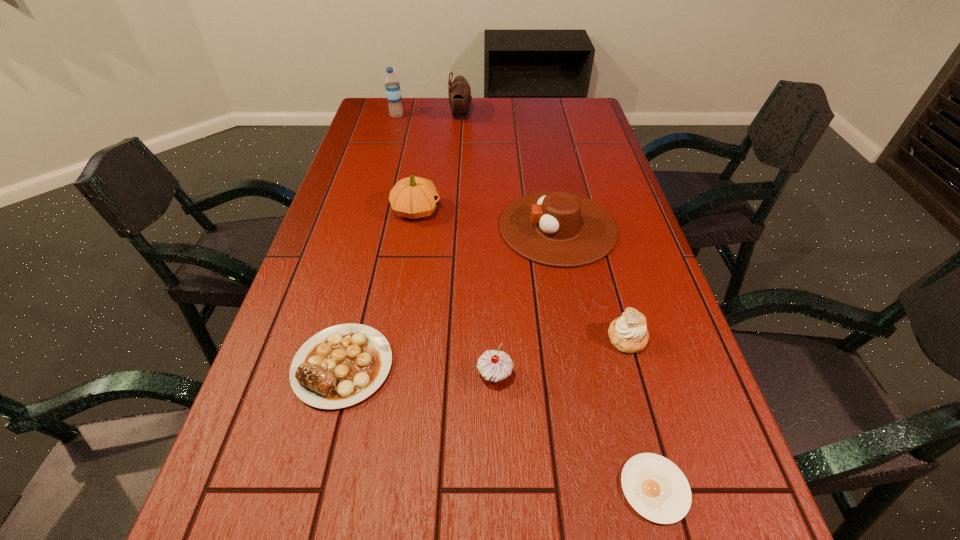
The height and width of the screenshot is (540, 960). In order to click on free area in between the cowboy hat and the cupcake in this screenshot , I will do `click(526, 301)`.

Find the location of a particular element. This screenshot has height=540, width=960. free spot between the shortest object and the second shortest object is located at coordinates (498, 427).

I want to click on free space between the water bottle and the gourd, so click(406, 163).

In order to click on free space between the pouch and the cupcake in this screenshot , I will do `click(478, 246)`.

The height and width of the screenshot is (540, 960). In order to click on empty location between the cowboy hat and the gourd in this screenshot , I will do `click(487, 219)`.

You are a GUI agent. You are given a task and a screenshot of the screen. Output one action in this format:
    pyautogui.click(x=<x>, y=<y>)
    Task: Click on the vacant area that lies between the second tallest object and the second shortest object
    The height and width of the screenshot is (540, 960).
    Given the screenshot: What is the action you would take?
    pyautogui.click(x=401, y=240)

You are a GUI agent. You are given a task and a screenshot of the screen. Output one action in this format:
    pyautogui.click(x=<x>, y=<y>)
    Task: Click on the vacant area that lies between the egg yolk and the cowboy hat
    This screenshot has width=960, height=540.
    Given the screenshot: What is the action you would take?
    [x=607, y=357]

Where is `free spot between the gourd and the egg yolk`? free spot between the gourd and the egg yolk is located at coordinates coord(536,349).

Where is `free space between the tallest object and the second tallest object`? Image resolution: width=960 pixels, height=540 pixels. free space between the tallest object and the second tallest object is located at coordinates (429, 116).

Identify which object is located as the seventh nearest to the gourd. Please provide its 2D coordinates. Your answer should be formatted as a tuple, i.e. [(x, y)], where the tuple contains the x and y coordinates of a point satisfying the conditions above.

[(655, 487)]